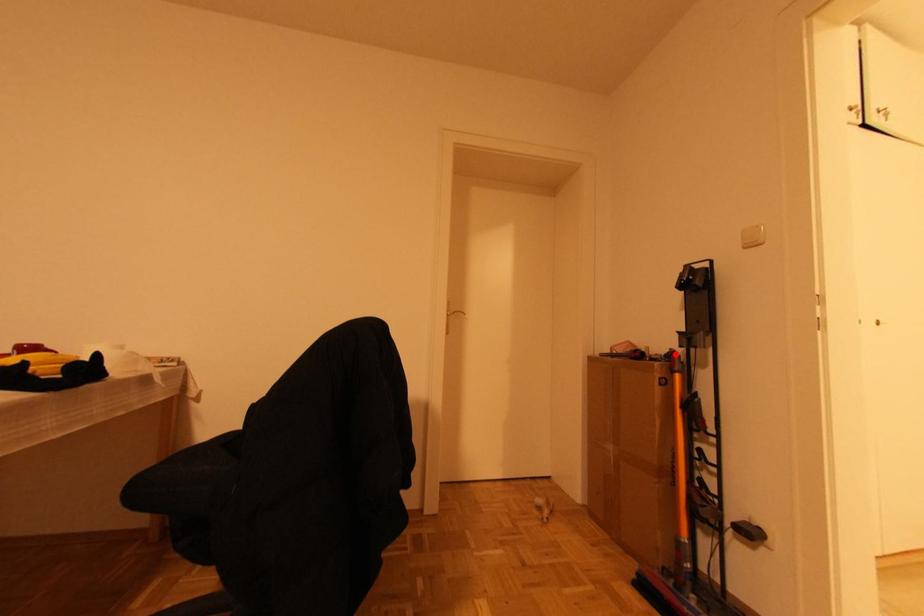
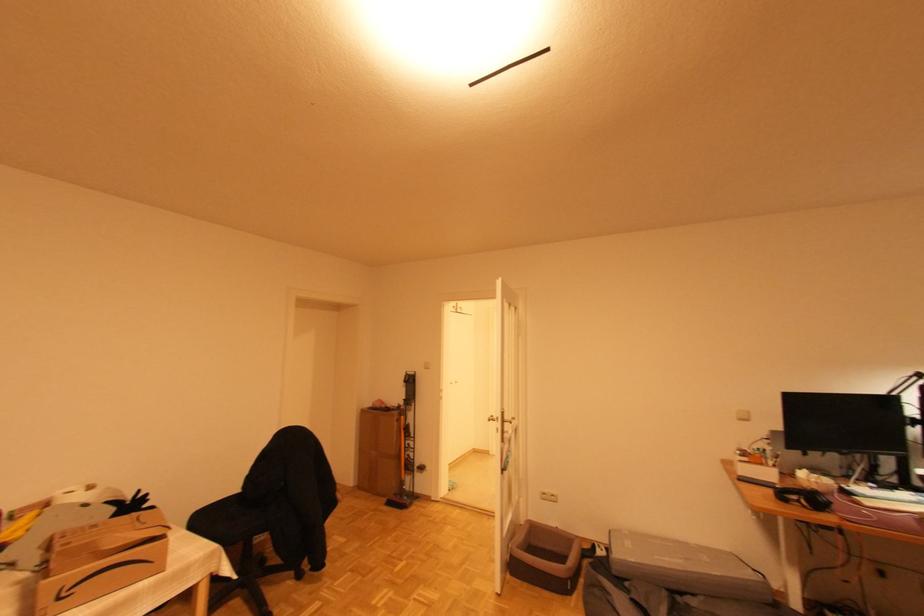
Question: A red point is marked in image1. In image2, is the corresponding 3D point closer to the camera or farther? Reply with the corresponding letter.

Choices:
 (A) The corresponding 3D point is closer.
 (B) The corresponding 3D point is farther.

Answer: (B)